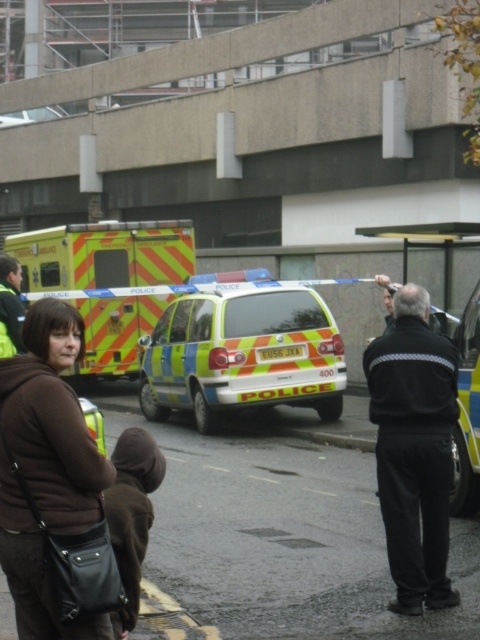
The height and width of the screenshot is (640, 480). Identify the location of black smooth jacket at center. (414, 449).

Does black smooth jacket at center come behind yellow reflective ambulance at left?

No, it is not.

Is point (428, 316) closer to camera compared to point (48, 250)?

Yes, it is in front of point (48, 250).

The image size is (480, 640). Identify the location of black smooth jacket at center. (414, 449).

Is yellow reflective van at center thinner than dark brown leather jacket at lower left?

Correct, yellow reflective van at center's width is less than dark brown leather jacket at lower left's.

Locate an element on the screen. This screenshot has height=640, width=480. yellow reflective van at center is located at coordinates (467, 412).

Locate an element on the screen. The height and width of the screenshot is (640, 480). yellow reflective van at center is located at coordinates (467, 412).

Does black smooth jacket at center lie behind yellow reflective van at center?

No, it is not.

Describe the element at coordinates (414, 449) in the screenshot. This screenshot has width=480, height=640. I see `black smooth jacket at center` at that location.

Identify the location of black smooth jacket at center. (414, 449).